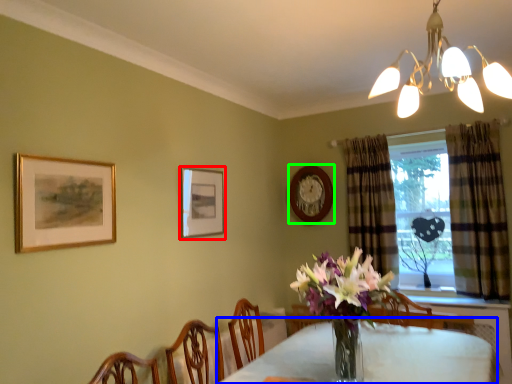
Question: Estimate the real-world distances between objects in this image. Which object is closer to picture frame (highlighted by a red box), table (highlighted by a blue box) or picture frame (highlighted by a green box)?

Choices:
 (A) table
 (B) picture frame

Answer: (B)